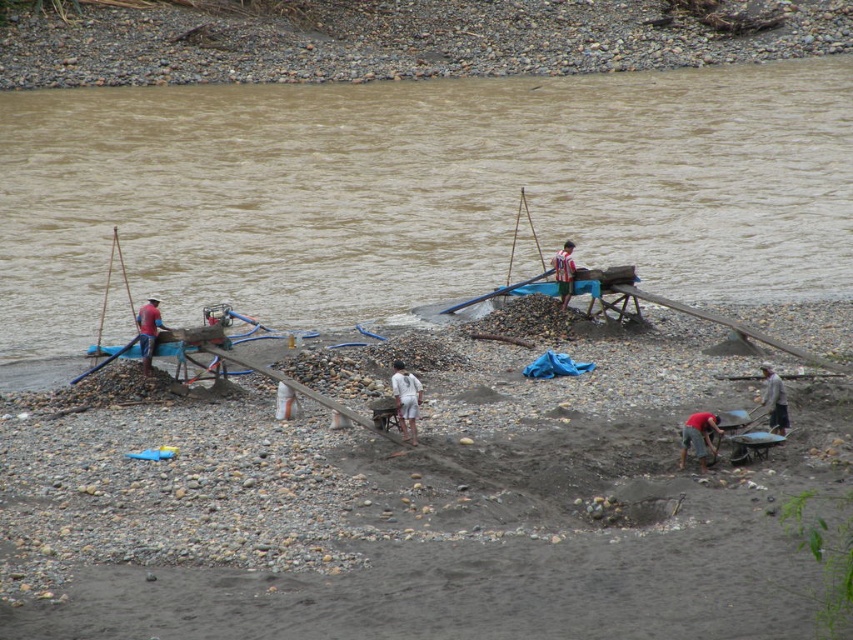
Describe the element at coordinates (418, 192) in the screenshot. I see `brown muddy water at center` at that location.

The image size is (853, 640). In order to click on brown muddy water at center in this screenshot , I will do `click(418, 192)`.

Which is in front, point (657, 150) or point (699, 465)?

Positioned in front is point (699, 465).

Locate an element on the screen. brown muddy water at center is located at coordinates (418, 192).

Who is higher up, red fabric shirt at lower right or striped shirt man at center?

Positioned higher is striped shirt man at center.

Is red fabric shirt at lower right to the right of striped shirt man at center from the viewer's perspective?

Indeed, red fabric shirt at lower right is positioned on the right side of striped shirt man at center.

The width and height of the screenshot is (853, 640). Describe the element at coordinates (698, 436) in the screenshot. I see `red fabric shirt at lower right` at that location.

This screenshot has height=640, width=853. In order to click on red fabric shirt at lower right in this screenshot , I will do `click(698, 436)`.

Is brown muddy water at center thinner than gray fabric at lower right?

No, brown muddy water at center is not thinner than gray fabric at lower right.

Does brown muddy water at center appear under gray fabric at lower right?

No, brown muddy water at center is not below gray fabric at lower right.

Between point (547, 92) and point (781, 387), which one is positioned in front?

Point (781, 387) is in front.

Locate an element on the screen. brown muddy water at center is located at coordinates (418, 192).